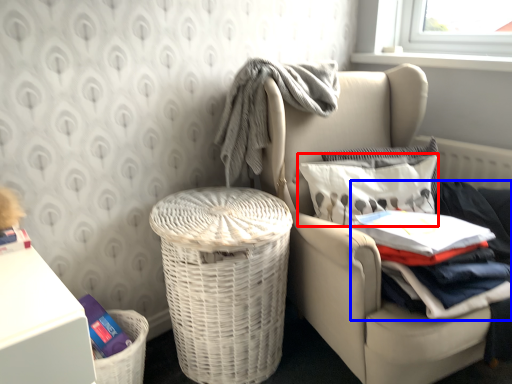
Question: Which point is further to the camera, pillow (highlighted by a red box) or clothing (highlighted by a blue box)?

Choices:
 (A) pillow
 (B) clothing

Answer: (A)